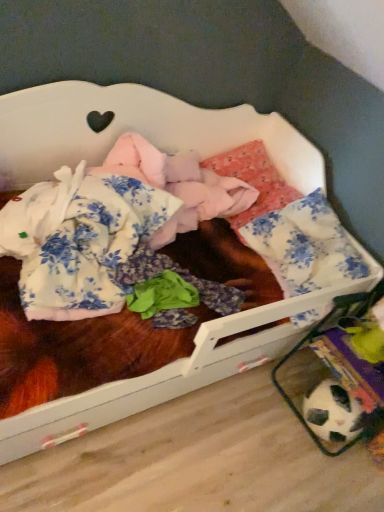
This screenshot has width=384, height=512. What do you see at coordinates (85, 242) in the screenshot?
I see `floral fabric at center` at bounding box center [85, 242].

Where is `floral fabric at center`? The image size is (384, 512). floral fabric at center is located at coordinates (85, 242).

Find the location of `floral fabric at center`. floral fabric at center is located at coordinates (85, 242).